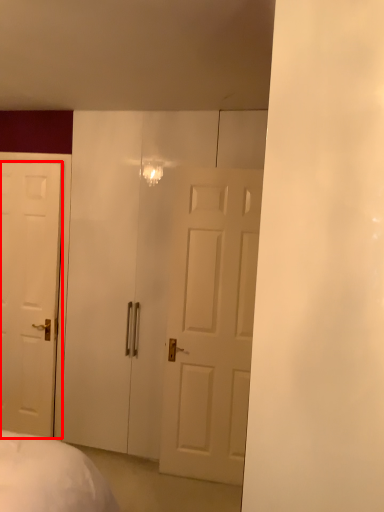
Question: In this image, where is door (annotated by the red box) located relative to glass door?

Choices:
 (A) right
 (B) left

Answer: (B)